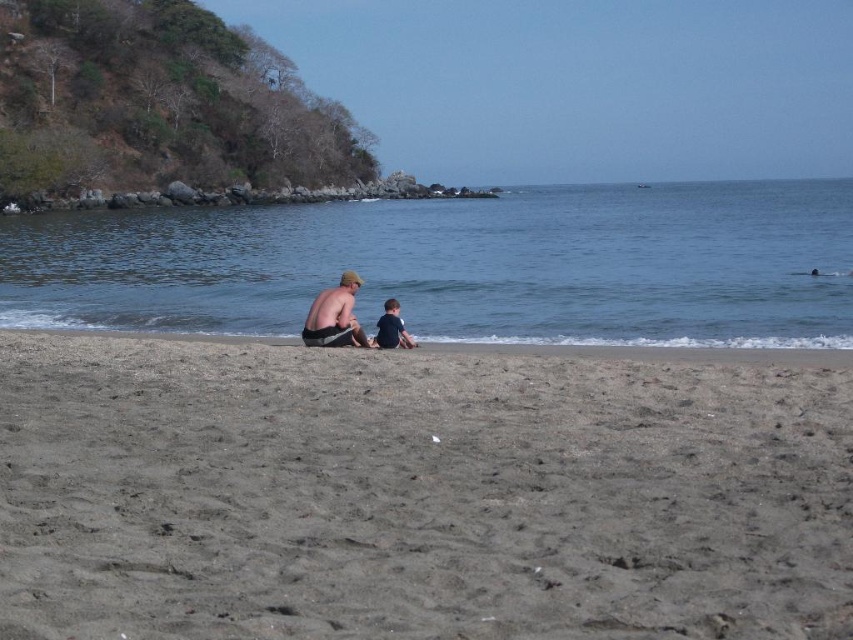
You are standing on the beach and want to place a buoy exactly at the location of the blue water at center. What coordinates should you use?

The coordinates for the blue water at center are at point (461, 266).

In the scene shown: You are standing on the beach looking towards the ocean. You see the brown sandy beach at center and the matte black shorts at center. Which object is closer to you?

The brown sandy beach at center is closer to you because it is positioned in front of the matte black shorts at center.

You are standing at the point marked by coordinates point (419,492). Which direction should you walk to reach the calm ocean in the background?

Since point (419,492) is on brown sandy beach at center, you should walk towards the shoreline towards the calm ocean in the background.